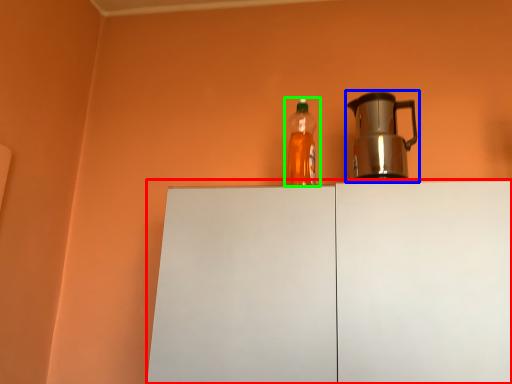
Question: Which object is the farthest from cabinetry (highlighted by a red box)? Choose among these: kettle (highlighted by a blue box) or bottle (highlighted by a green box).

Choices:
 (A) kettle
 (B) bottle

Answer: (A)